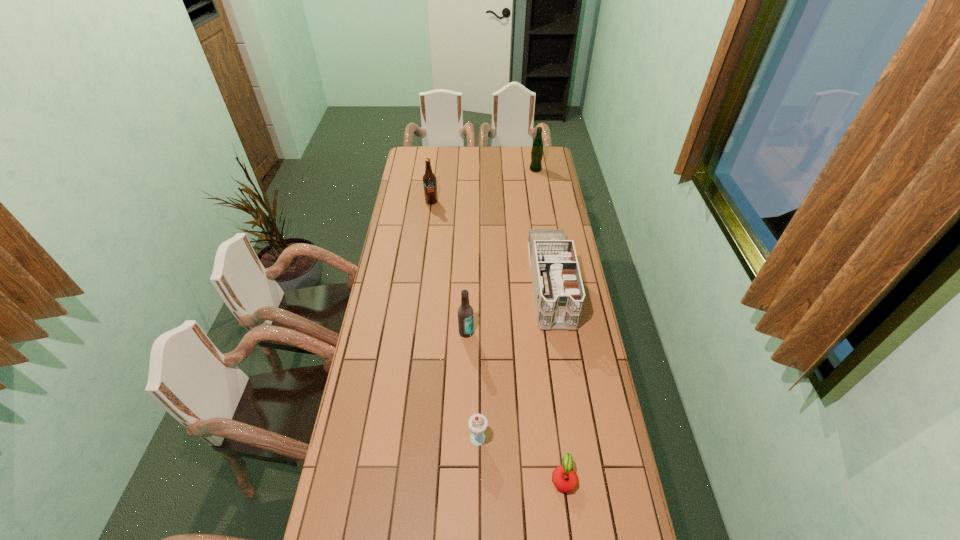
Image resolution: width=960 pixels, height=540 pixels. Find the location of `the farthest object`. the farthest object is located at coordinates (537, 147).

What are the coordinates of `the farthest beer bottle` in the screenshot? It's located at (537, 147).

This screenshot has height=540, width=960. I want to click on the second farthest beer bottle, so click(x=429, y=179).

Locate an element on the screen. the fifth nearest object is located at coordinates (429, 179).

Find the location of `the nearest beer bottle`. the nearest beer bottle is located at coordinates (465, 312).

Locate an element on the screen. dollhouse is located at coordinates (558, 290).

At what (x,y) coordinates should I click in order to perform the action: click on milkshake. Please return your answer as a coordinate pair (x, y). The height and width of the screenshot is (540, 960). Looking at the image, I should click on (477, 423).

Locate an element on the screen. the nearest object is located at coordinates (565, 479).

Identify the location of the shortest object. This screenshot has height=540, width=960. coord(565,479).

Find the location of a particular element. free space located on the back of the rightmost beer bottle is located at coordinates (532, 147).